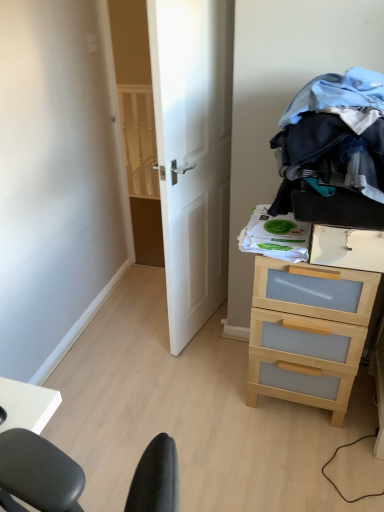
Question: Can you confirm if denim fabric clothes at upper right is positioned to the left of white wooden door at center?

Choices:
 (A) yes
 (B) no

Answer: (B)

Question: Is denim fabric clothes at upper right bigger than white wooden door at center?

Choices:
 (A) no
 (B) yes

Answer: (A)

Question: Does denim fabric clothes at upper right have a lesser height compared to white wooden door at center?

Choices:
 (A) yes
 (B) no

Answer: (A)

Question: From the image's perspective, is denim fabric clothes at upper right beneath white wooden door at center?

Choices:
 (A) no
 (B) yes

Answer: (A)

Question: Is the position of denim fabric clothes at upper right less distant than that of white wooden door at center?

Choices:
 (A) yes
 (B) no

Answer: (A)

Question: Based on their positions, is white wooden door at center located to the left or right of light wood/ribbed drawer at right?

Choices:
 (A) right
 (B) left

Answer: (B)

Question: From the image's perspective, is white wooden door at center above or below light wood/ribbed drawer at right?

Choices:
 (A) above
 (B) below

Answer: (A)

Question: In terms of height, does white wooden door at center look taller or shorter compared to light wood/ribbed drawer at right?

Choices:
 (A) short
 (B) tall

Answer: (B)

Question: Looking at the image, does white wooden door at center seem bigger or smaller compared to light wood/ribbed drawer at right?

Choices:
 (A) big
 (B) small

Answer: (A)

Question: Considering their positions, is white wooden door at center located in front of or behind denim fabric clothes at upper right?

Choices:
 (A) behind
 (B) front

Answer: (A)

Question: From a real-world perspective, relative to denim fabric clothes at upper right, is white wooden door at center vertically above or below?

Choices:
 (A) below
 (B) above

Answer: (A)

Question: Is point (205, 166) positioned closer to the camera than point (375, 177)?

Choices:
 (A) farther
 (B) closer

Answer: (A)

Question: Looking at their shapes, would you say white wooden door at center is wider or thinner than denim fabric clothes at upper right?

Choices:
 (A) wide
 (B) thin

Answer: (B)

Question: Is point (317, 129) positioned closer to the camera than point (228, 22)?

Choices:
 (A) closer
 (B) farther

Answer: (A)

Question: Is denim fabric clothes at upper right inside or outside of white wooden door at center?

Choices:
 (A) inside
 (B) outside

Answer: (B)